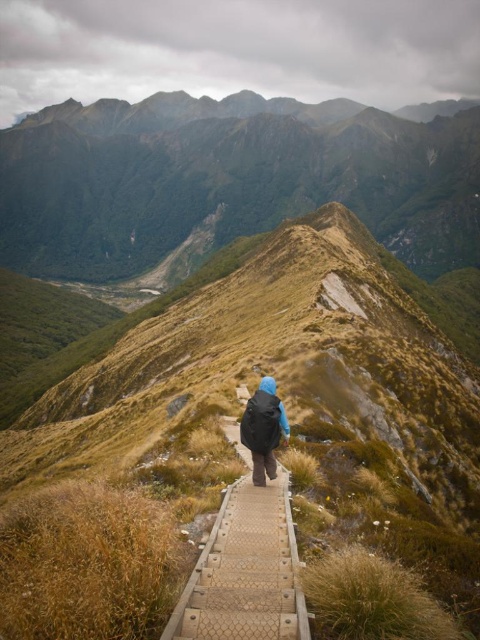
Question: Can you confirm if brown grassy hill at center is positioned above textured wooden boardwalk at center?

Choices:
 (A) no
 (B) yes

Answer: (A)

Question: Is green mossy mountain at upper center thinner than blue matte jacket at center?

Choices:
 (A) no
 (B) yes

Answer: (A)

Question: Which point is closer to the camera?

Choices:
 (A) textured wooden boardwalk at center
 (B) brown grassy hill at center

Answer: (B)

Question: Which point is farther from the camera taking this photo?

Choices:
 (A) (257, 611)
 (B) (428, 385)
 (C) (276, 429)
 (D) (155, 106)

Answer: (D)

Question: Which object is farther from the camera taking this photo?

Choices:
 (A) brown grassy hill at center
 (B) textured wooden boardwalk at center
 (C) blue matte jacket at center
 (D) green mossy mountain at upper center

Answer: (D)

Question: Considering the relative positions of textured wooden boardwalk at center and blue matte jacket at center in the image provided, where is textured wooden boardwalk at center located with respect to blue matte jacket at center?

Choices:
 (A) above
 (B) below

Answer: (B)